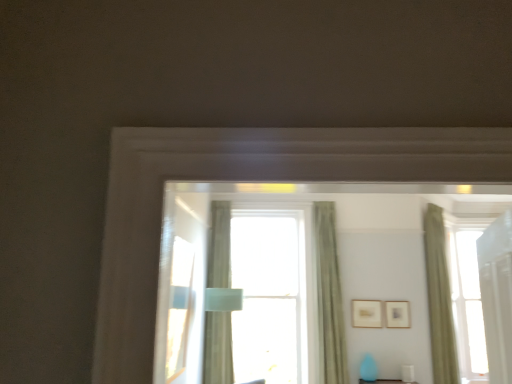
Question: From a real-world perspective, is silky green curtain at center, placed as the 3th curtain when sorted from right to left, beneath matte gold picture frame at upper center, positioned as the 1th picture frame in right-to-left order?

Choices:
 (A) yes
 (B) no

Answer: (B)

Question: From the image's perspective, is silky green curtain at center, placed as the 3th curtain when sorted from right to left, located beneath matte gold picture frame at upper center, positioned as the 1th picture frame in right-to-left order?

Choices:
 (A) yes
 (B) no

Answer: (B)

Question: From a real-world perspective, does silky green curtain at center, the first curtain in the left-to-right sequence, stand above matte gold picture frame at upper center, positioned as the 1th picture frame in right-to-left order?

Choices:
 (A) no
 (B) yes

Answer: (B)

Question: Is silky green curtain at center, the first curtain in the left-to-right sequence, located outside matte gold picture frame at upper center, the 2th picture frame in the left-to-right sequence?

Choices:
 (A) yes
 (B) no

Answer: (A)

Question: Can you confirm if silky green curtain at center, placed as the 3th curtain when sorted from right to left, is positioned to the left of matte gold picture frame at upper center, the 2th picture frame in the left-to-right sequence?

Choices:
 (A) yes
 (B) no

Answer: (A)

Question: Would you say green textured curtain at center, arranged as the second curtain when viewed from the right, is to the left or to the right of clear glass window at center in the picture?

Choices:
 (A) left
 (B) right

Answer: (B)

Question: From a real-world perspective, is green textured curtain at center, placed as the 2th curtain when sorted from left to right, positioned above or below clear glass window at center?

Choices:
 (A) below
 (B) above

Answer: (B)

Question: Which is correct: green textured curtain at center, placed as the 2th curtain when sorted from left to right, is inside clear glass window at center, or outside of it?

Choices:
 (A) inside
 (B) outside

Answer: (B)

Question: From the image's perspective, is green textured curtain at center, arranged as the second curtain when viewed from the right, above or below clear glass window at center?

Choices:
 (A) above
 (B) below

Answer: (A)

Question: Would you say matte gold picture frame at upper center, positioned as the 1th picture frame in right-to-left order, is to the left or to the right of clear glass window at center in the picture?

Choices:
 (A) left
 (B) right

Answer: (B)

Question: Considering the positions of matte gold picture frame at upper center, positioned as the 1th picture frame in right-to-left order, and clear glass window at center in the image, is matte gold picture frame at upper center, positioned as the 1th picture frame in right-to-left order, bigger or smaller than clear glass window at center?

Choices:
 (A) small
 (B) big

Answer: (A)

Question: From the image's perspective, relative to clear glass window at center, is matte gold picture frame at upper center, the 2th picture frame in the left-to-right sequence, above or below?

Choices:
 (A) below
 (B) above

Answer: (A)

Question: Considering the positions of point (390, 317) and point (306, 334), is point (390, 317) closer or farther from the camera than point (306, 334)?

Choices:
 (A) farther
 (B) closer

Answer: (B)

Question: Relative to green textured curtain at center, placed as the 2th curtain when sorted from left to right, is wooden picture frame at upper right, the first picture frame when ordered from left to right, in front or behind?

Choices:
 (A) front
 (B) behind

Answer: (B)

Question: Looking at the image, does wooden picture frame at upper right, which is the 2th picture frame from right to left, seem bigger or smaller compared to green textured curtain at center, placed as the 2th curtain when sorted from left to right?

Choices:
 (A) big
 (B) small

Answer: (B)